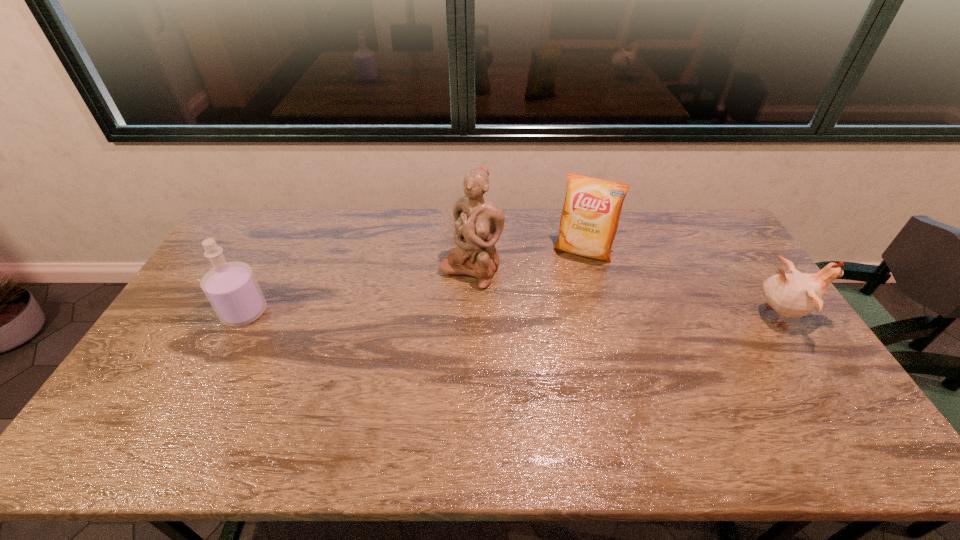
Where is `vacant area situated 0.170m on the front-facing side of the tallest object`? This screenshot has width=960, height=540. vacant area situated 0.170m on the front-facing side of the tallest object is located at coordinates (424, 323).

Where is `vacant space situated 0.190m on the front-facing side of the tallest object`? vacant space situated 0.190m on the front-facing side of the tallest object is located at coordinates (420, 327).

In order to click on free location located on the front-facing side of the tallest object in this screenshot , I will do `click(396, 356)`.

Locate an element on the screen. The image size is (960, 540). object located at the far edge is located at coordinates (590, 216).

I want to click on object that is at the left edge, so click(231, 287).

This screenshot has height=540, width=960. Find the location of `object situated at the right edge`. object situated at the right edge is located at coordinates (795, 295).

Identify the location of vacant space at the far edge of the desktop. The height and width of the screenshot is (540, 960). (507, 245).

In the image, there is a desktop. What are the coordinates of `free region at the near edge` in the screenshot? It's located at (480, 400).

The image size is (960, 540). I want to click on free region at the left edge, so click(184, 363).

The image size is (960, 540). I want to click on blank space at the right edge of the desktop, so click(769, 357).